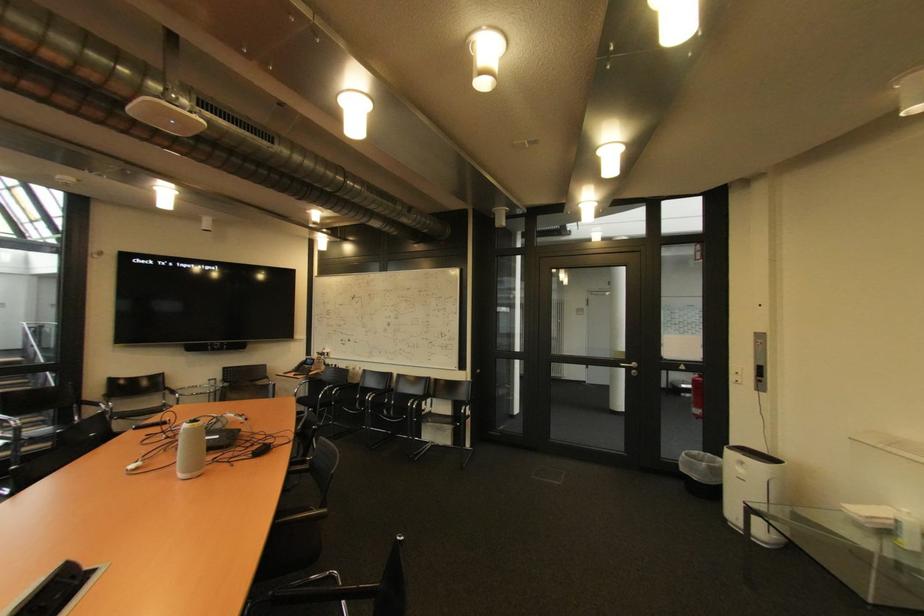
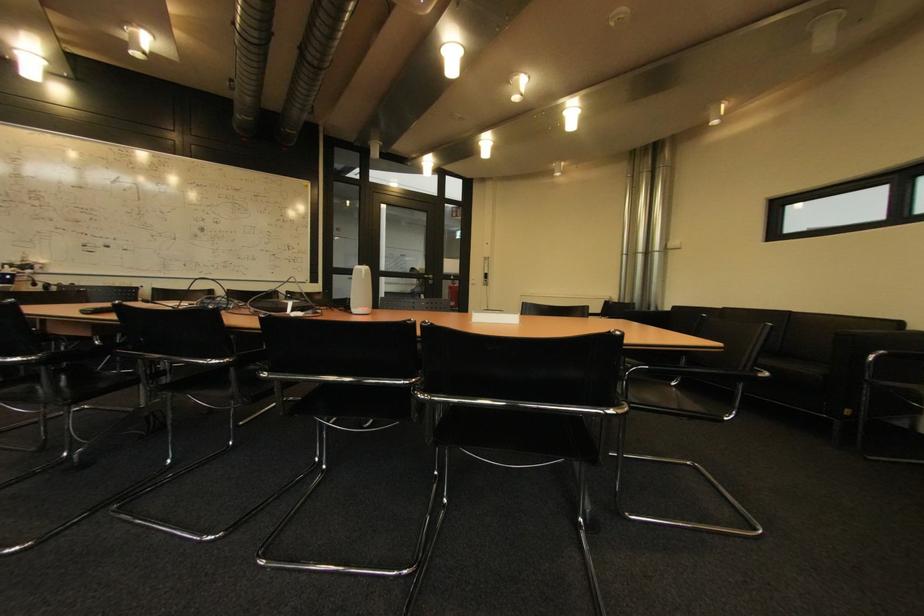
Locate, in the second image, the point that corresponds to point 681,368 in the first image.

(456, 278)